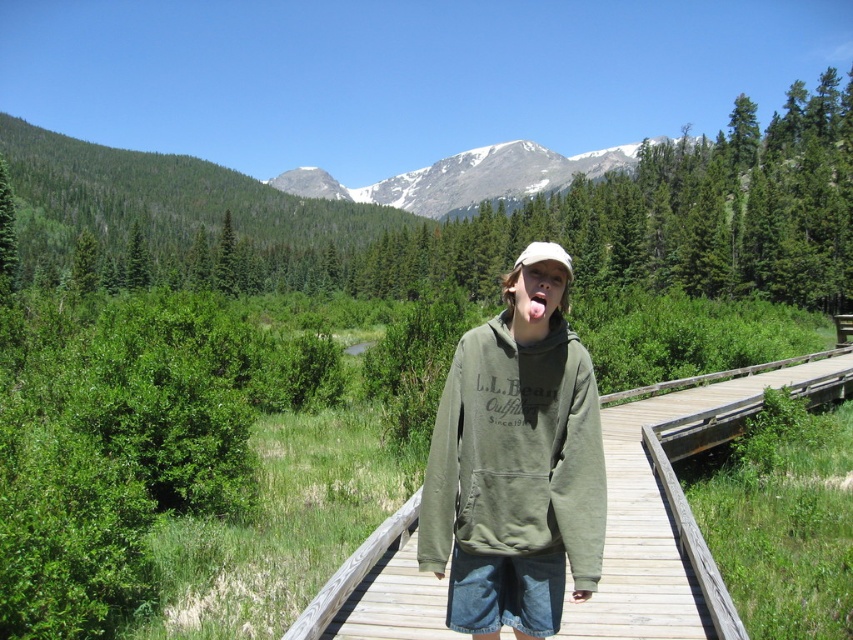
Question: Is wooden at center behind snowy granite mountain at upper center?

Choices:
 (A) yes
 (B) no

Answer: (B)

Question: Does wooden at center have a smaller size compared to snowy granite mountain at upper center?

Choices:
 (A) no
 (B) yes

Answer: (B)

Question: Which object is farther from the camera taking this photo?

Choices:
 (A) snowy granite mountain at upper center
 (B) olive green hoodie at center
 (C) wooden at center

Answer: (A)

Question: Is wooden at center behind snowy granite mountain at upper center?

Choices:
 (A) no
 (B) yes

Answer: (A)

Question: Which point is closer to the camera?

Choices:
 (A) olive green hoodie at center
 (B) snowy granite mountain at upper center
 (C) wooden at center

Answer: (A)

Question: Which point is farther from the camera taking this photo?

Choices:
 (A) (419, 180)
 (B) (621, 598)
 (C) (585, 355)

Answer: (A)